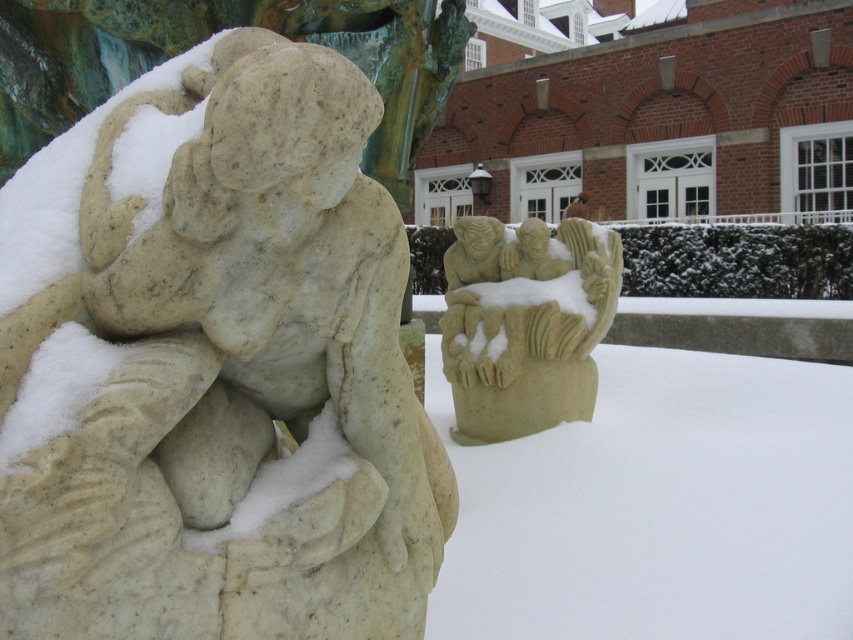
Between white marble statue at left and beige stone carving at center, which one has more height?

With more height is beige stone carving at center.

Between white marble statue at left and beige stone carving at center, which one appears on the left side from the viewer's perspective?

Positioned to the left is white marble statue at left.

I want to click on white marble statue at left, so click(x=213, y=364).